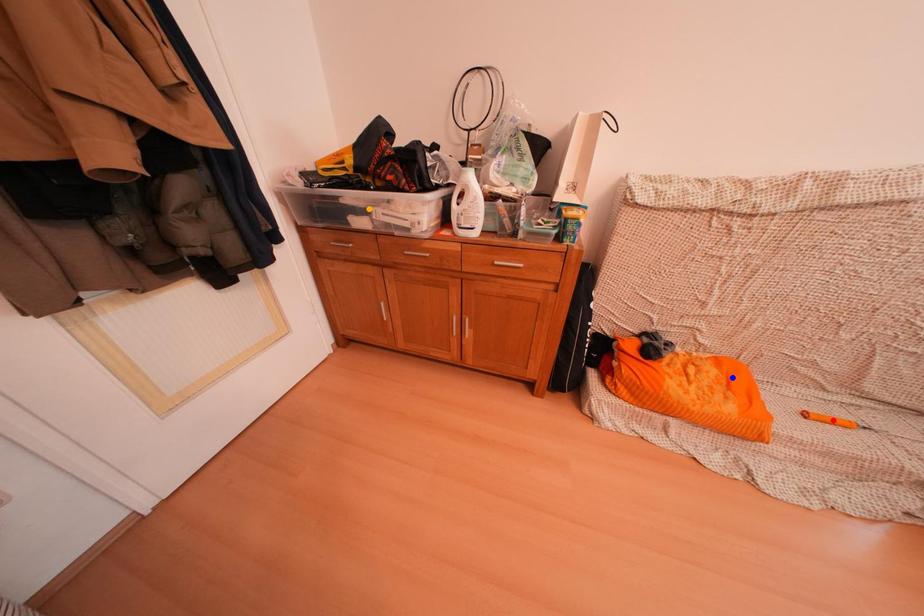
Order these from nearest to farthest:
- blue point
- red point
- orange point

1. red point
2. orange point
3. blue point